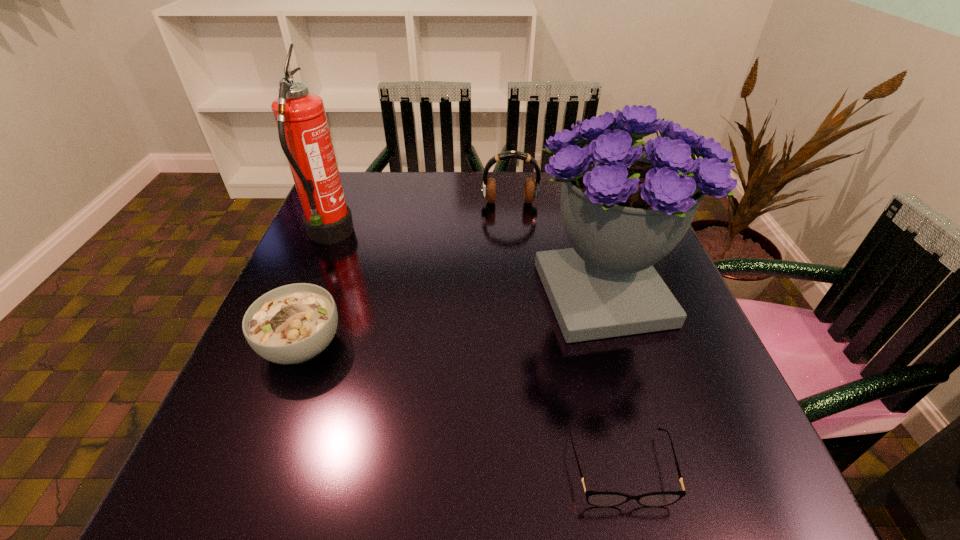
Find the location of `vacant space at the far edge of the desktop`. vacant space at the far edge of the desktop is located at coordinates (384, 212).

Identify the location of vacant space at the near edge of the desktop. The width and height of the screenshot is (960, 540). (621, 507).

The width and height of the screenshot is (960, 540). I want to click on vacant space at the left edge, so click(358, 238).

Identify the location of vacant space at the right edge of the desktop. Image resolution: width=960 pixels, height=540 pixels. (702, 377).

In the image, there is a desktop. Where is `vacant space at the far left corner`? The width and height of the screenshot is (960, 540). vacant space at the far left corner is located at coordinates (381, 175).

Where is `vacant position at the near left corner of the desktop`? This screenshot has height=540, width=960. vacant position at the near left corner of the desktop is located at coordinates (193, 471).

Identify the location of free space between the farthest object and the bouquet. 557,248.

Find the location of a particular element. This screenshot has width=960, height=540. vacant space that's between the spectacles and the soup bowl is located at coordinates 461,407.

This screenshot has height=540, width=960. What are the coordinates of `vacant area between the bouquet and the third tallest object` in the screenshot? It's located at (557, 248).

The height and width of the screenshot is (540, 960). I want to click on free spot between the fourth tallest object and the third shortest object, so click(x=406, y=274).